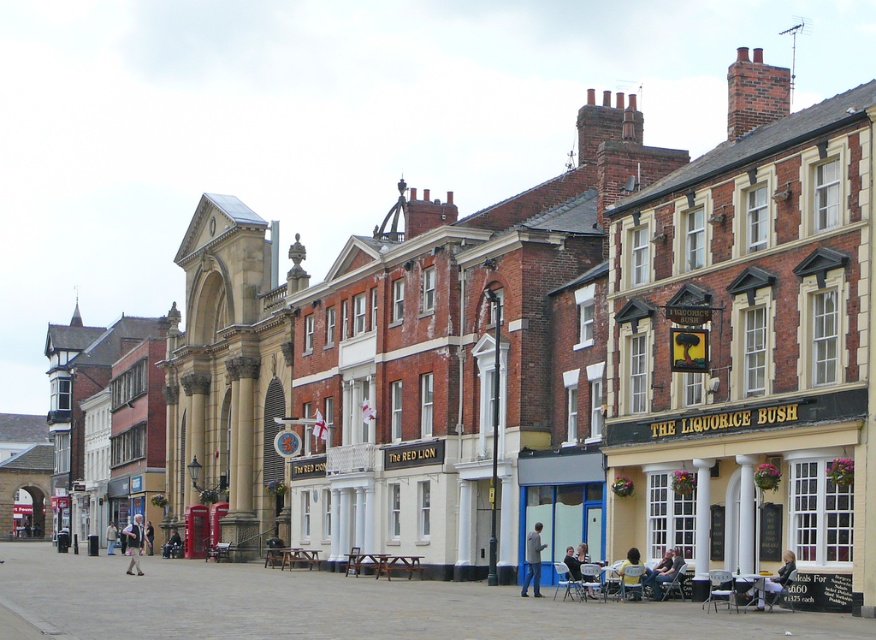
Question: Can you confirm if yellow matte pub at center is positioned to the right of light brown leather jacket at center?

Choices:
 (A) no
 (B) yes

Answer: (B)

Question: From the image, what is the correct spatial relationship of yellow matte pub at center in relation to light brown leather jacket at lower left?

Choices:
 (A) left
 (B) right

Answer: (B)

Question: Among these objects, which one is farthest from the camera?

Choices:
 (A) light brown leather jacket at lower left
 (B) yellow matte pub at center
 (C) light brown leather jacket at center

Answer: (C)

Question: Is blue glass door at center wider than light brown leather jacket at center?

Choices:
 (A) no
 (B) yes

Answer: (A)

Question: Among these objects, which one is nearest to the camera?

Choices:
 (A) light brown leather jacket at lower left
 (B) yellow matte pub at center
 (C) light brown leather jacket at center
 (D) light blue jeans at lower right

Answer: (B)

Question: Which of the following is the closest to the observer?

Choices:
 (A) light blue jeans at lower right
 (B) blue jeans at lower right
 (C) light brown leather jacket at lower left

Answer: (A)